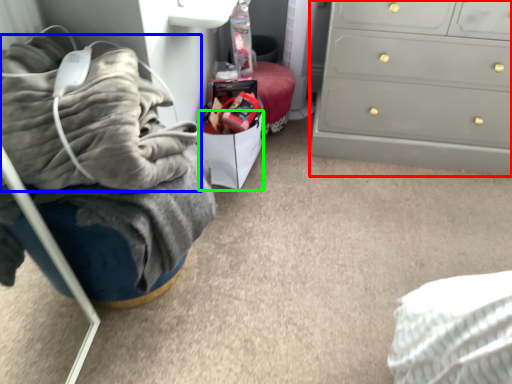
Question: Considering the real-world distances, which object is closest to chest of drawers (highlighted by a red box)? blanket (highlighted by a blue box) or drawer (highlighted by a green box).

Choices:
 (A) blanket
 (B) drawer

Answer: (B)